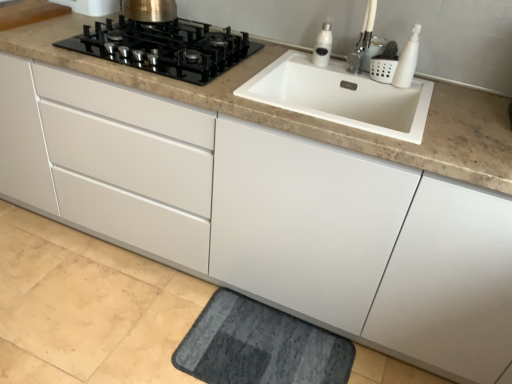
I want to click on free space above dark gray textured bath mat at lower center (from a real-world perspective), so click(x=263, y=354).